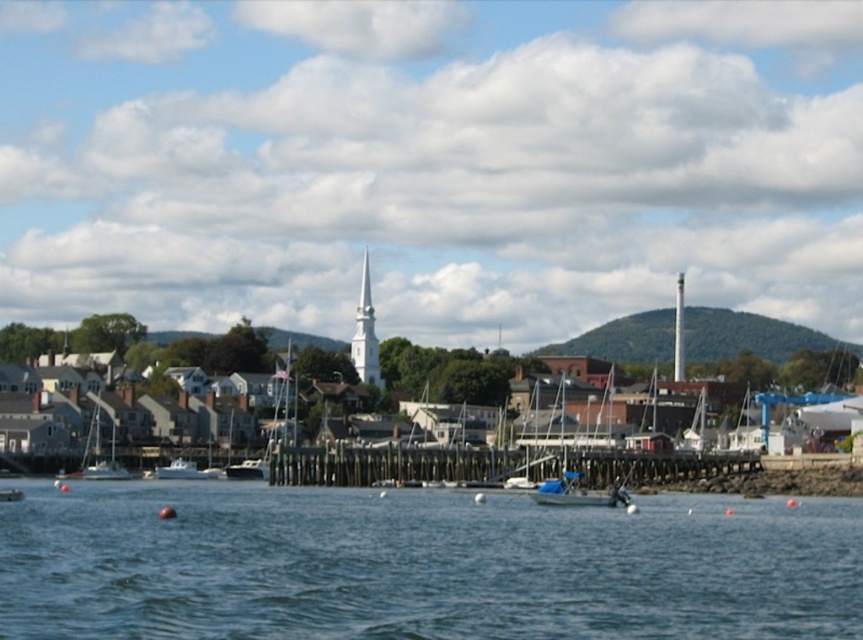
Question: Is white smooth spire at upper center smaller than white matte boat at lower left?

Choices:
 (A) no
 (B) yes

Answer: (A)

Question: Among these points, which one is nearest to the camera?

Choices:
 (A) (559, 504)
 (B) (4, 490)
 (C) (266, 467)
 (D) (364, 356)

Answer: (A)

Question: Can you confirm if blue fabric boat at center is bigger than white smooth spire at upper center?

Choices:
 (A) no
 (B) yes

Answer: (A)

Question: Which object is positioned closest to the blue water at lower center?

Choices:
 (A) white smooth spire at upper center
 (B) white matte boat at center
 (C) white matte boat at lower left
 (D) white smooth spire at center

Answer: (C)

Question: Does white glossy boat at center appear under white matte boat at center?

Choices:
 (A) no
 (B) yes

Answer: (A)

Question: Which object is closer to the camera taking this photo?

Choices:
 (A) white smooth spire at center
 (B) blue fabric boat at center
 (C) white glossy boat at center
 (D) white smooth spire at upper center

Answer: (B)